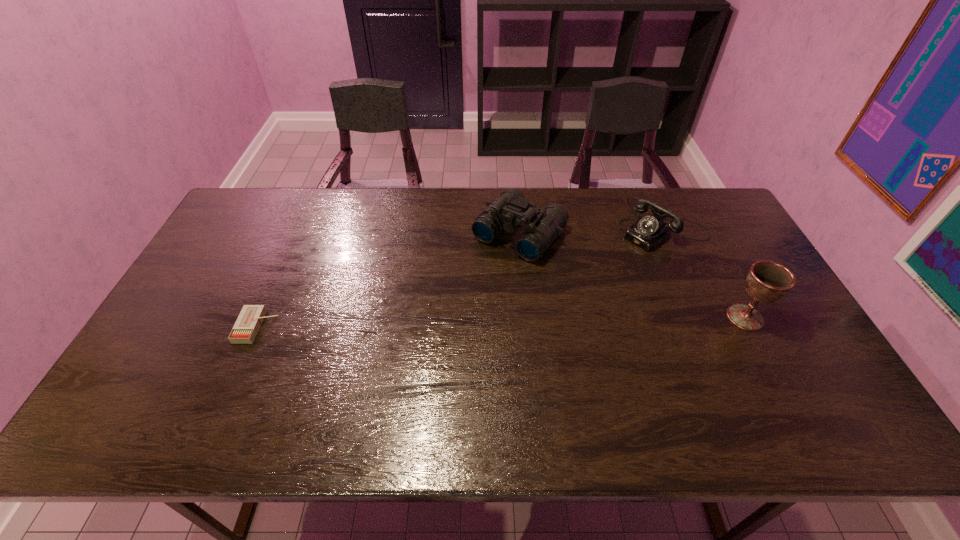
The width and height of the screenshot is (960, 540). In order to click on vacant position at the left edge of the desktop in this screenshot , I will do `click(249, 244)`.

Find the location of a particular element. Image resolution: width=960 pixels, height=540 pixels. free space at the right edge is located at coordinates (732, 265).

Image resolution: width=960 pixels, height=540 pixels. In the image, there is a desktop. In order to click on vacant space at the far left corner in this screenshot , I will do `click(261, 230)`.

The width and height of the screenshot is (960, 540). In the image, there is a desktop. Identify the location of vacant space at the far right corner. (682, 200).

Where is `free space between the third object from right to left and the telephone`? Image resolution: width=960 pixels, height=540 pixels. free space between the third object from right to left and the telephone is located at coordinates (592, 232).

The width and height of the screenshot is (960, 540). What are the coordinates of `vacant space that's between the binoculars and the chalice` in the screenshot? It's located at tap(633, 275).

I want to click on unoccupied area between the binoculars and the chalice, so click(x=633, y=275).

Locate an element on the screen. unoccupied area between the binoculars and the third tallest object is located at coordinates (592, 232).

The height and width of the screenshot is (540, 960). Identify the location of empty space that is in between the chalice and the leftmost object. (501, 322).

Identify the location of vacant area that lies between the third object from right to left and the telephone. The image size is (960, 540). (592, 232).